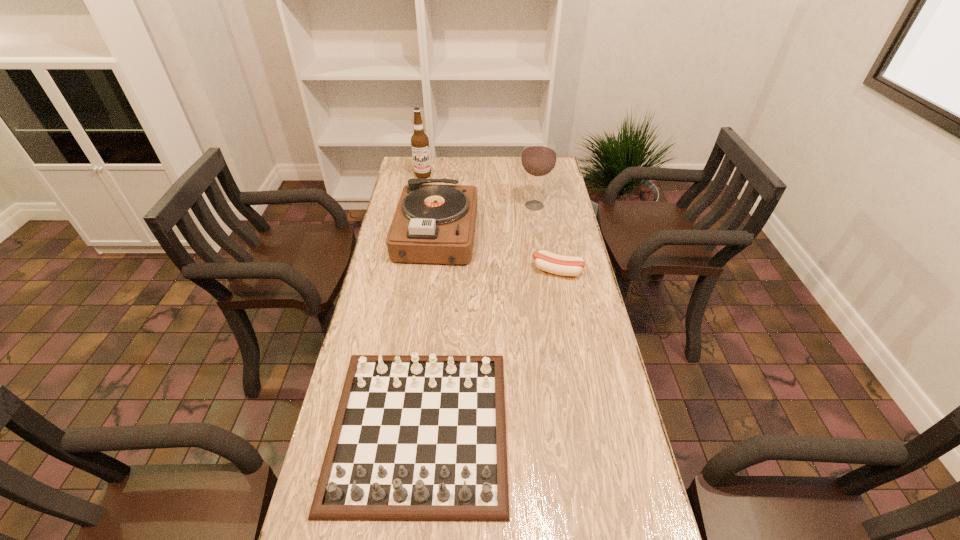
Where is `free region at the right edge of the desktop`? This screenshot has height=540, width=960. free region at the right edge of the desktop is located at coordinates (563, 381).

Where is `vacant space at the far left corner of the desktop`? vacant space at the far left corner of the desktop is located at coordinates (400, 180).

Identify the location of vacant space at the far right corner of the desktop. tap(541, 177).

At what (x,y) coordinates should I click in order to perform the action: click on free space between the shortest object and the nearest object. Please return your answer as a coordinate pair (x, y). The image size is (960, 540). Looking at the image, I should click on tap(489, 349).

The image size is (960, 540). What are the coordinates of `vacant space that is in between the nearest object and the farther alcohol` in the screenshot? It's located at (421, 301).

This screenshot has height=540, width=960. Identify the location of free space between the farther alcohol and the nearer alcohol. (479, 191).

Identify the location of empty space between the record player and the second shortest object. The image size is (960, 540). (428, 331).

Locate an element on the screen. The width and height of the screenshot is (960, 540). free space between the shortest object and the right alcohol is located at coordinates (545, 238).

Where is `free area in between the farther alcohol and the nearest object`? The width and height of the screenshot is (960, 540). free area in between the farther alcohol and the nearest object is located at coordinates (421, 301).

Locate an element on the screen. vacant space in between the record player and the second shortest object is located at coordinates (428, 331).